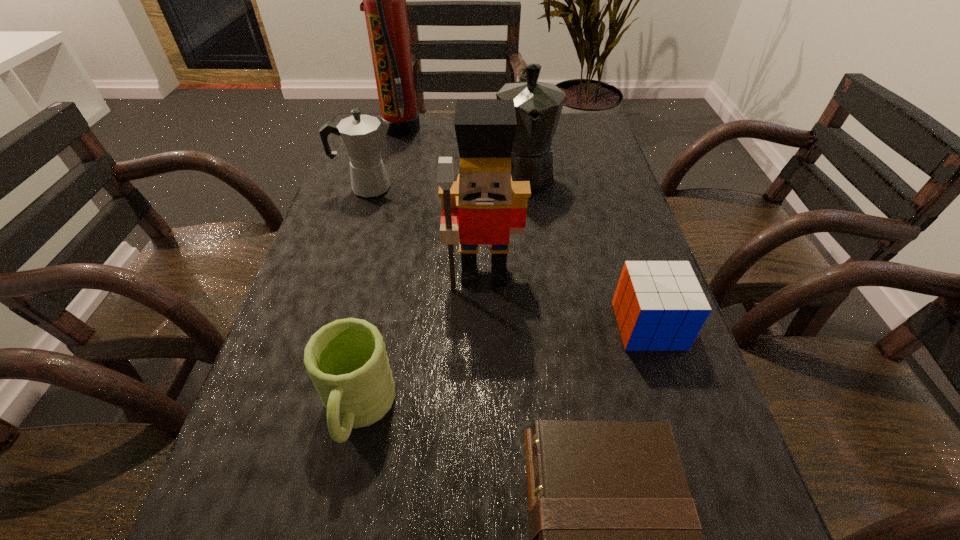
The image size is (960, 540). Identify the location of the third nearest object. (659, 305).

The width and height of the screenshot is (960, 540). In order to click on free space located with the nozzle pointing from the back of the fire extinguisher in this screenshot , I will do `click(496, 129)`.

Locate an element on the screen. This screenshot has width=960, height=540. blank space located 0.270m in front of the second tallest object holding the staff is located at coordinates (486, 433).

At what (x,y) coordinates should I click in order to perform the action: click on vacant space located 0.100m on the pouring side of the right coffeepot. Please return your answer as a coordinate pair (x, y). Looking at the image, I should click on (531, 230).

Find the location of `free space located on the back of the left coffeepot`. free space located on the back of the left coffeepot is located at coordinates (387, 126).

Where is `free space located 0.080m on the side of the fifth tallest object with the handle`? free space located 0.080m on the side of the fifth tallest object with the handle is located at coordinates (335, 525).

Where is `vacant area situated 0.290m on the front of the sixth tallest object`? This screenshot has height=540, width=960. vacant area situated 0.290m on the front of the sixth tallest object is located at coordinates click(x=719, y=537).

The height and width of the screenshot is (540, 960). I want to click on fire extinguisher at the far edge, so click(x=384, y=0).

In order to click on coffeepot present at the far edge in this screenshot , I will do `click(538, 105)`.

Where is `fire extinguisher that is at the left edge`? The height and width of the screenshot is (540, 960). fire extinguisher that is at the left edge is located at coordinates (384, 0).